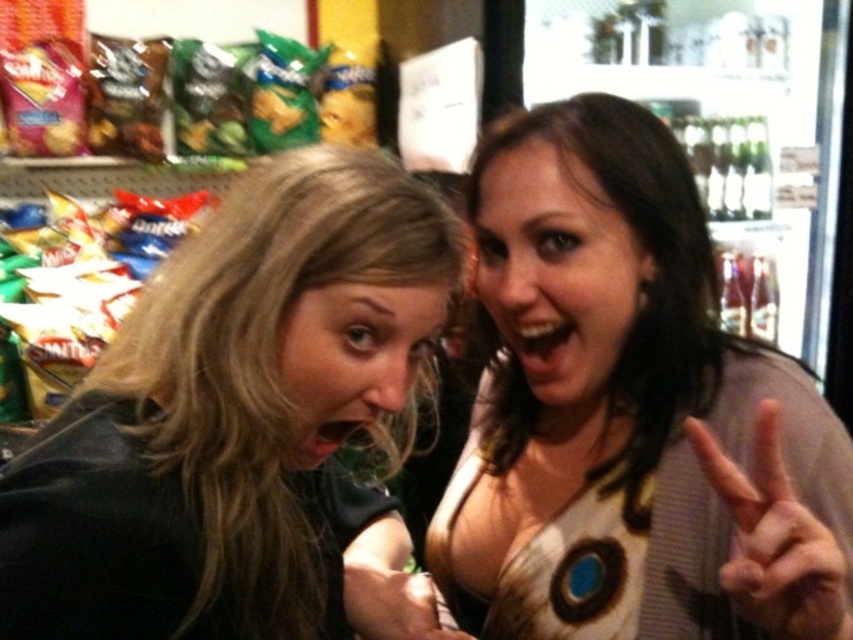
Can you confirm if white matte chips at left is positioned to the left of smooth skin hand at center?

Correct, you'll find white matte chips at left to the left of smooth skin hand at center.

Which of these two, white matte chips at left or smooth skin hand at center, stands shorter?

smooth skin hand at center

Measure the distance between point (90, 260) and camera.

They are 6.01 feet apart.

Find the location of a particular element. The width and height of the screenshot is (853, 640). white matte chips at left is located at coordinates (86, 291).

Does matte brown hair at center have a greater height compared to white matte hand at center right?

Correct, matte brown hair at center is much taller as white matte hand at center right.

Who is taller, matte brown hair at center or white matte hand at center right?

matte brown hair at center

Does point (503, 371) lie in front of point (782, 538)?

No.

I want to click on matte brown hair at center, so click(x=643, y=280).

Is matte brown blouse at center thinner than matte brown chips at upper left?

Yes.

The image size is (853, 640). Identify the location of matte brown blouse at center. (630, 412).